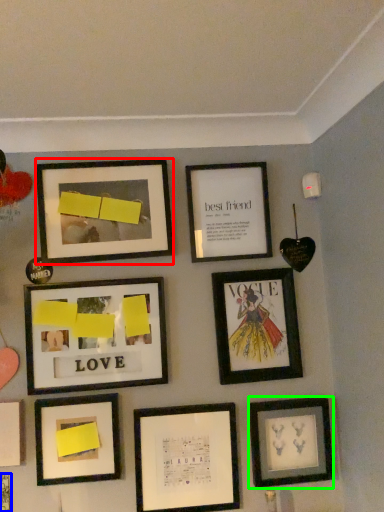
Question: Which object is the closest to the picture frame (highlighted by a red box)? Choose among these: picture frame (highlighted by a blue box) or picture frame (highlighted by a green box).

Choices:
 (A) picture frame
 (B) picture frame

Answer: (B)